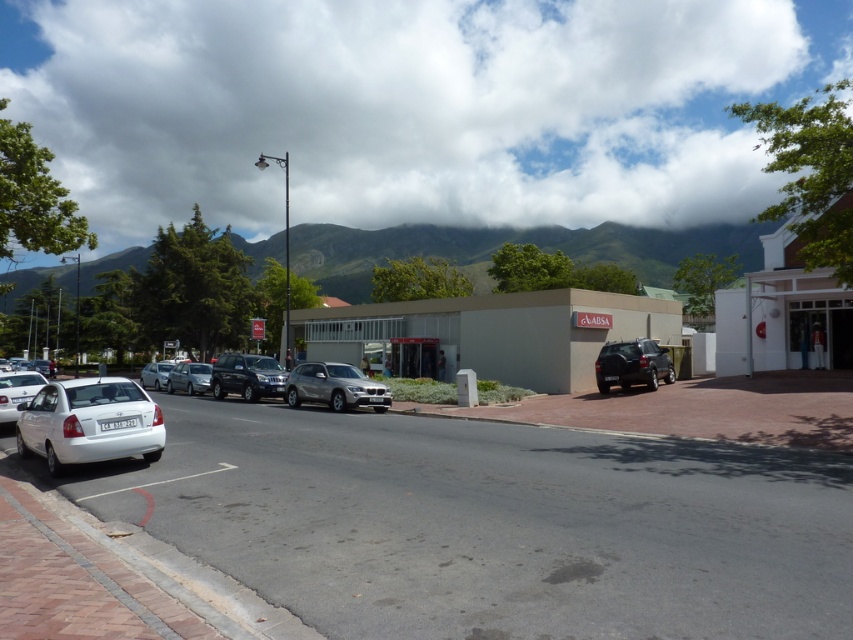
Is matte black suv at center-right smaller than white glossy sedan at left?

Indeed, matte black suv at center-right has a smaller size compared to white glossy sedan at left.

This screenshot has height=640, width=853. What do you see at coordinates (631, 364) in the screenshot?
I see `matte black suv at center-right` at bounding box center [631, 364].

Where is `matte black suv at center-right`? matte black suv at center-right is located at coordinates (631, 364).

Is point (444, 419) positioned after point (144, 369)?

No, it is in front of (144, 369).

Which is in front, point (651, 504) or point (157, 378)?

Positioned in front is point (651, 504).

This screenshot has width=853, height=640. Identify the location of smooth asphalt parking lot at center. (492, 524).

The width and height of the screenshot is (853, 640). In order to click on smooth asphalt parking lot at center in this screenshot , I will do click(492, 524).

Does white matte sedan at lower left appear over satin silver sedan at center?

Indeed, white matte sedan at lower left is positioned over satin silver sedan at center.

What do you see at coordinates (90, 422) in the screenshot? This screenshot has height=640, width=853. I see `white matte sedan at lower left` at bounding box center [90, 422].

Which is behind, point (68, 429) or point (202, 368)?

Point (202, 368)

The image size is (853, 640). Identify the location of white matte sedan at lower left. (90, 422).